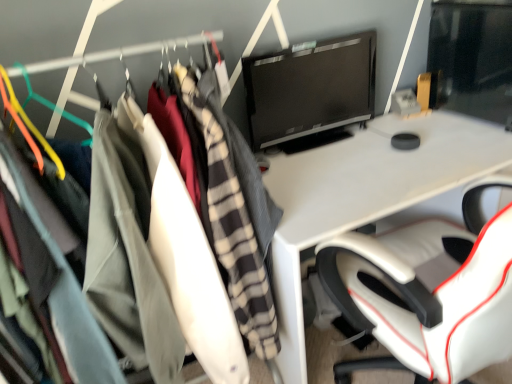
Locate an element on the screen. Image resolution: width=512 pixels, height=384 pixels. vacant space to the right of black glossy monitor at upper right is located at coordinates (400, 138).